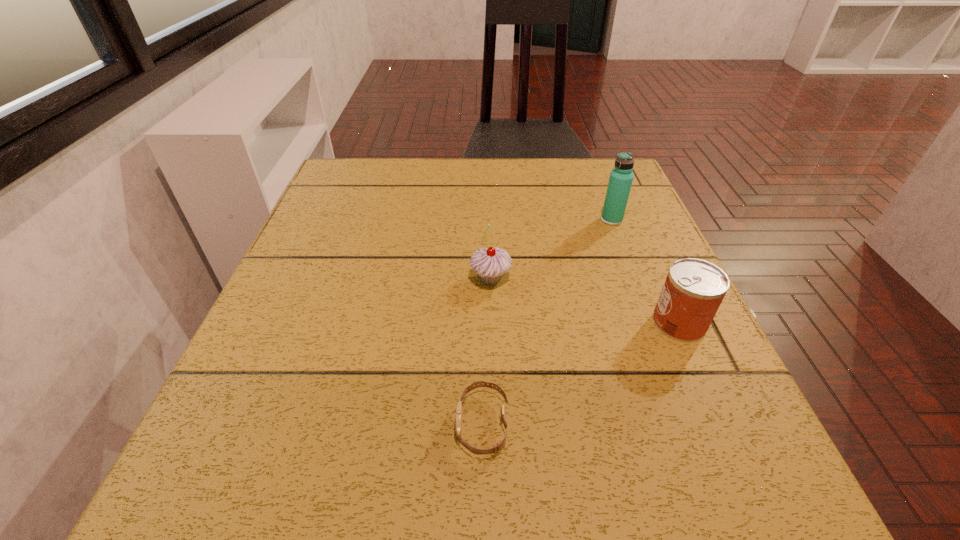
The image size is (960, 540). What are the coordinates of `thermos bottle` in the screenshot? It's located at (621, 178).

Find the location of a particular element. Image resolution: width=960 pixels, height=540 pixels. the tallest object is located at coordinates (621, 178).

The width and height of the screenshot is (960, 540). In order to click on the second farthest object in this screenshot , I will do `click(490, 264)`.

You are a GUI agent. You are given a task and a screenshot of the screen. Output one action in this format:
    pyautogui.click(x=<x>, y=<y>)
    Task: Click on the can
    
    Given the screenshot: What is the action you would take?
    pyautogui.click(x=693, y=290)

This screenshot has height=540, width=960. I want to click on watch, so click(x=496, y=448).

You are a GUI agent. You are given a task and a screenshot of the screen. Output one action in this format:
    pyautogui.click(x=<x>, y=<y>)
    Task: Click on the nearest object
    The width and height of the screenshot is (960, 540).
    Given the screenshot: What is the action you would take?
    pyautogui.click(x=496, y=448)

Find the location of a particular element. The image size is (960, 540). vacant space located 0.090m on the left of the thermos bottle is located at coordinates (562, 220).

The width and height of the screenshot is (960, 540). In order to click on free location located 0.130m on the front of the second farthest object in this screenshot , I will do `click(492, 348)`.

Find the location of a particular element. This screenshot has width=960, height=540. vacant space located 0.050m on the back of the can is located at coordinates (662, 286).

This screenshot has width=960, height=540. I want to click on free point located 0.070m on the face of the nearest object, so click(407, 424).